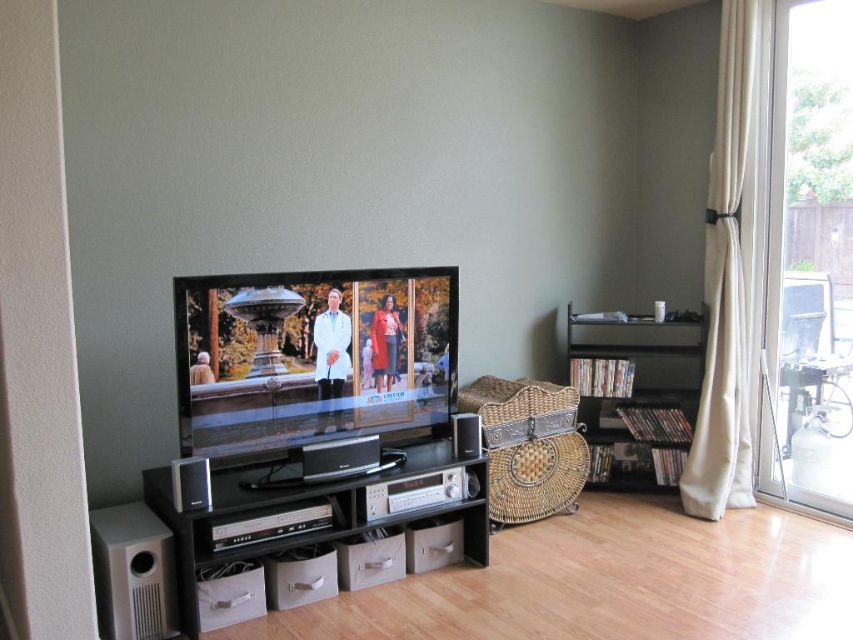
Who is shorter, transparent glass door at right or white fabric curtain at right?

Standing shorter between the two is transparent glass door at right.

Which is more to the left, transparent glass door at right or white fabric curtain at right?

white fabric curtain at right is more to the left.

Which is in front, point (838, 163) or point (728, 474)?

Point (838, 163) is more forward.

Identify the location of transparent glass door at right. The image size is (853, 640). (809, 260).

Which is more to the left, white fabric curtain at right or black matte bookshelf at right?

black matte bookshelf at right is more to the left.

Where is `white fabric curtain at right`? white fabric curtain at right is located at coordinates (724, 289).

Is flat screen tv at center positioned in front of white fabric curtain at right?

Yes, it is in front of white fabric curtain at right.

Does flat screen tv at center have a smaller size compared to white fabric curtain at right?

Actually, flat screen tv at center might be larger than white fabric curtain at right.

Between point (341, 364) and point (737, 385), which one is positioned behind?

The point (737, 385) is more distant.

Find the location of a particular element. The image size is (853, 640). flat screen tv at center is located at coordinates (311, 355).